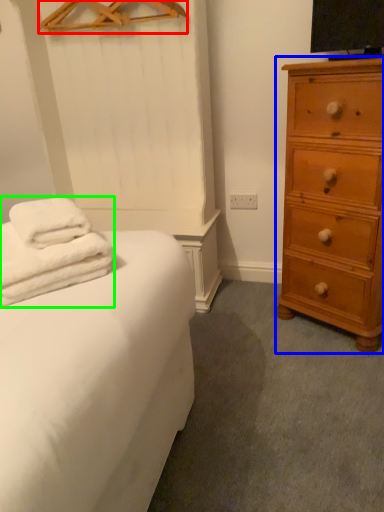
Question: Considering the real-world distances, which object is farthest from hanger (highlighted by a red box)? chest of drawers (highlighted by a blue box) or bath towel (highlighted by a green box)?

Choices:
 (A) chest of drawers
 (B) bath towel

Answer: (B)